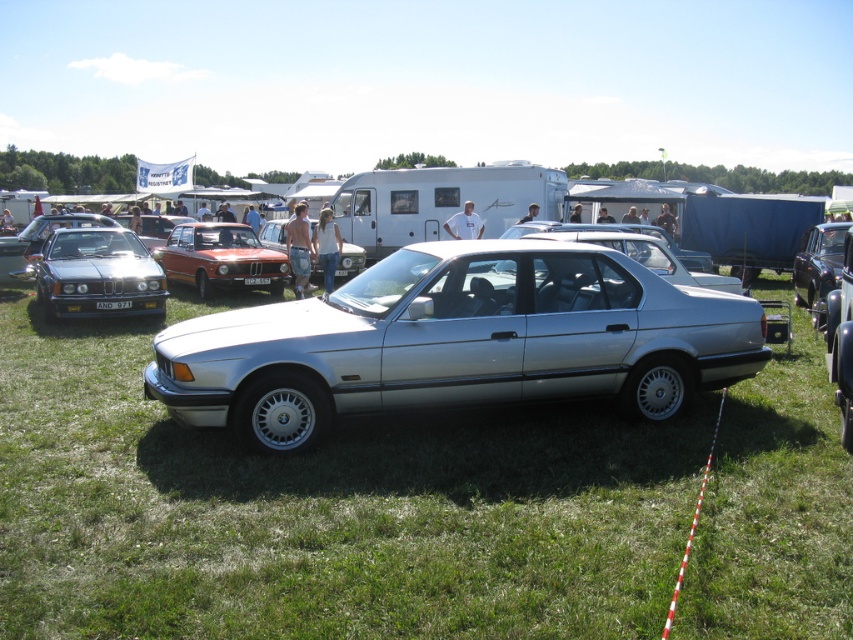
Question: Is silver metallic car at center further to the viewer compared to shiny black sedan at center?

Choices:
 (A) no
 (B) yes

Answer: (A)

Question: Is shiny silver sedan at left positioned before white plastic license plate at center?

Choices:
 (A) no
 (B) yes

Answer: (B)

Question: Which object is closer to the camera taking this photo?

Choices:
 (A) orange glossy sedan at center
 (B) shiny black sedan at center

Answer: (B)

Question: Which point is closer to the camera?

Choices:
 (A) orange glossy sedan at center
 (B) shiny black sedan at center
 (C) shiny silver sedan at left
 (D) matte silver sedan at center

Answer: (C)

Question: Can you confirm if silver metallic car at center is positioned above satin silver car at center?

Choices:
 (A) yes
 (B) no

Answer: (B)

Question: Based on their relative distances, which object is nearer to the shiny silver sedan at left?

Choices:
 (A) matte silver sedan at center
 (B) satin silver car at center
 (C) white plastic license plate at center

Answer: (C)